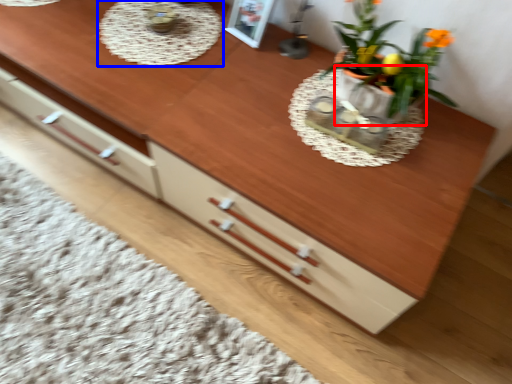
Question: Which object is closer to the camera taking this photo, flowerpot (highlighted by a red box) or round table (highlighted by a blue box)?

Choices:
 (A) flowerpot
 (B) round table

Answer: (A)